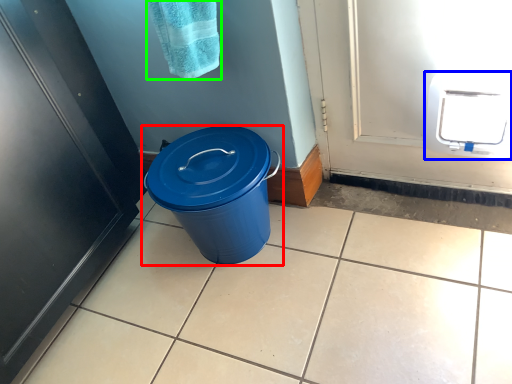
Question: Which object is positioned farthest from waste container (highlighted by a red box)? Select from appliance (highlighted by a blue box) and bath towel (highlighted by a green box).

Choices:
 (A) appliance
 (B) bath towel

Answer: (A)